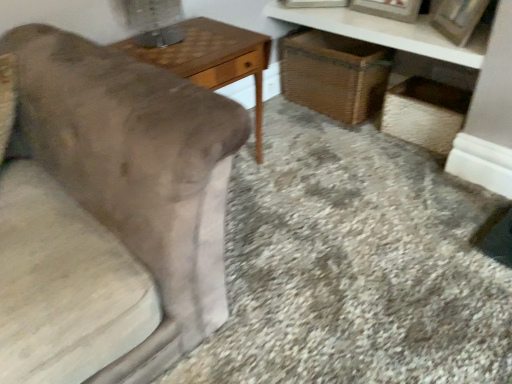
This screenshot has width=512, height=384. I want to click on free spot to the right of woodenobject at left, so click(x=300, y=173).